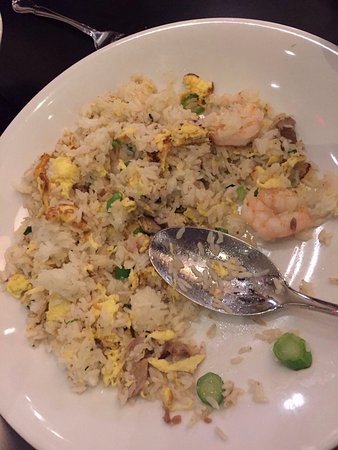
Find the location of `spoon handle`. spoon handle is located at coordinates (316, 304).